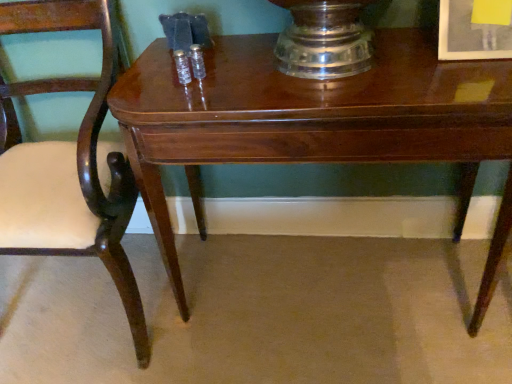
This screenshot has width=512, height=384. In order to click on free space below mahogany wood chair at left (from a real-world perspective) in this screenshot , I will do click(86, 302).